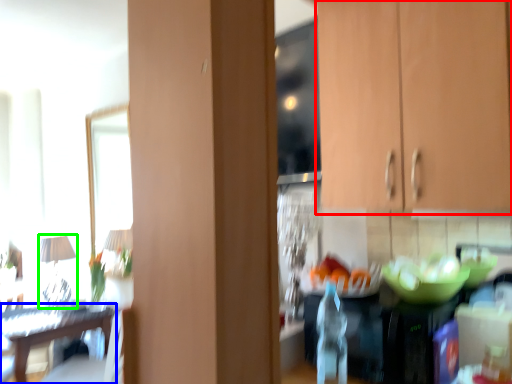
Question: Which object is the closest to the cabinetry (highlighted by a red box)? Choose among these: table (highlighted by a blue box) or lamp (highlighted by a green box).

Choices:
 (A) table
 (B) lamp

Answer: (A)